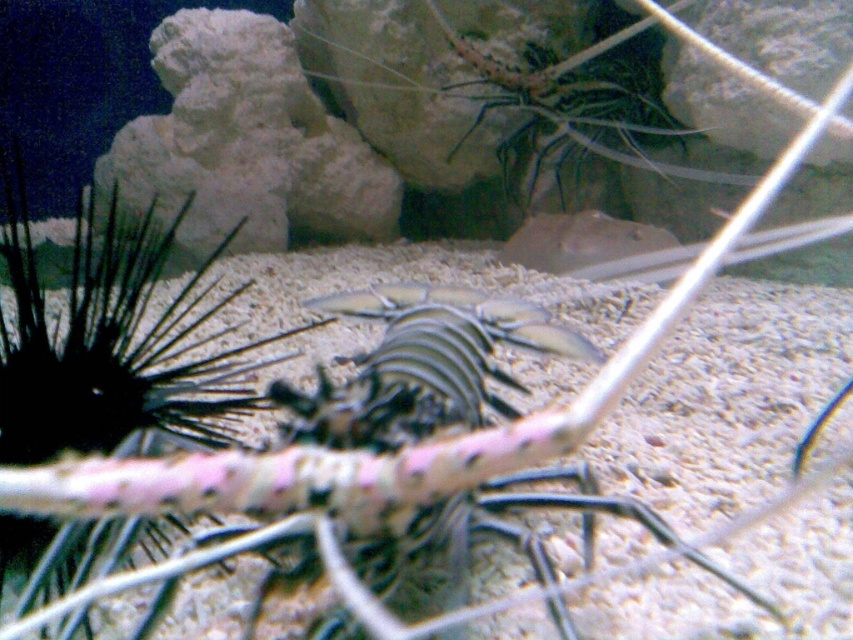
You are an underwater explorer observing the scene. You notice the shiny black lobster at center and the translucent glass shrimp at upper center. Which of these two creatures is positioned to the right side of the other?

The translucent glass shrimp at upper center is to the right of the shiny black lobster at center.

You are a marine biologist observing an underwater scene in an aquarium. You notice a point marked at coordinates (380, 476). What object is located at this point?

The point at coordinates (380, 476) marks the shiny black lobster at center.

You are an underwater photographer aiming to capture the shiny black lobster at center and the translucent glass shrimp at upper center in the same frame. Based on their sizes, which one would appear smaller in your photo?

The shiny black lobster at center appears smaller in the photo because it is thinner than the translucent glass shrimp at upper center.